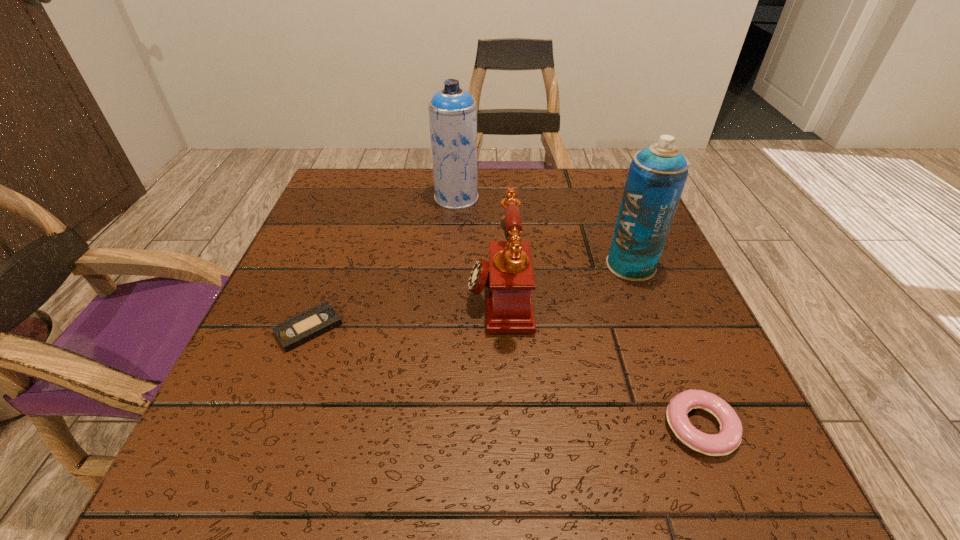
Identify the location of vacant area that lies between the farthest object and the telephone. The height and width of the screenshot is (540, 960). (478, 246).

At what (x,y) coordinates should I click in order to perform the action: click on free spot between the left aerosol can and the third shortest object. Please return your answer as a coordinate pair (x, y). The image size is (960, 540). Looking at the image, I should click on (478, 246).

Find the location of a particular element. The width and height of the screenshot is (960, 540). free space between the shortest object and the nearer aerosol can is located at coordinates (469, 297).

I want to click on vacant space in between the nearer aerosol can and the leftmost object, so click(469, 297).

This screenshot has width=960, height=540. In order to click on free space that is in between the fourth tallest object and the nearer aerosol can in this screenshot , I will do `click(665, 346)`.

Image resolution: width=960 pixels, height=540 pixels. Find the location of `vacant area that lies between the right aerosol can and the leftmost object`. vacant area that lies between the right aerosol can and the leftmost object is located at coordinates (469, 297).

You are a GUI agent. You are given a task and a screenshot of the screen. Output one action in this format:
    pyautogui.click(x=<x>, y=<y>)
    Task: Click on the free space between the telephone and the farthest object
    
    Given the screenshot: What is the action you would take?
    pyautogui.click(x=478, y=246)

Identify the location of the second closest object to the third tallest object. The height and width of the screenshot is (540, 960). (452, 111).

Where is `object that can be found as the closest to the shortest object`? object that can be found as the closest to the shortest object is located at coordinates (508, 277).

Where is `vacant space that satisfies the following two spatial constraints: 1. on the dial of the third tallest object; 2. on the right side of the second shortest object`? The width and height of the screenshot is (960, 540). vacant space that satisfies the following two spatial constraints: 1. on the dial of the third tallest object; 2. on the right side of the second shortest object is located at coordinates (506, 427).